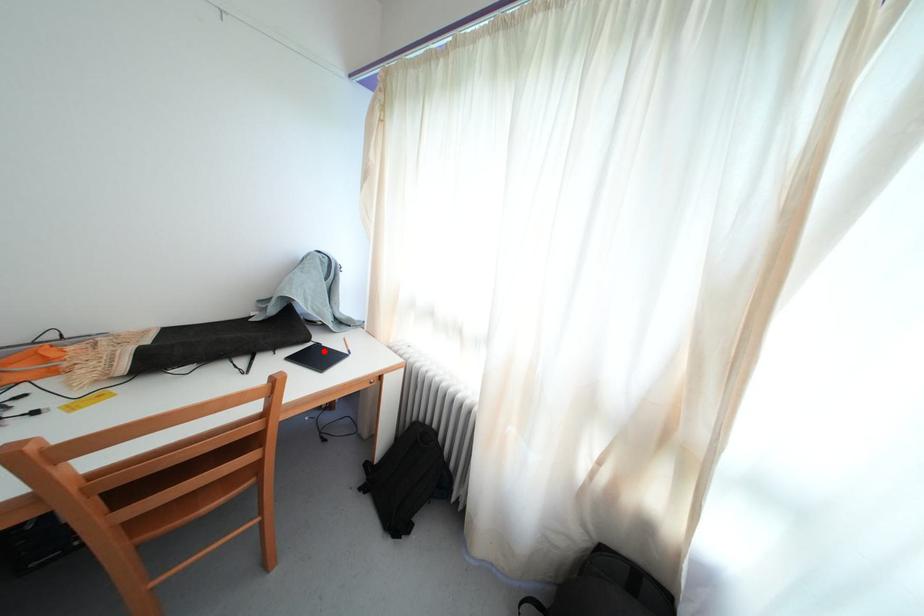
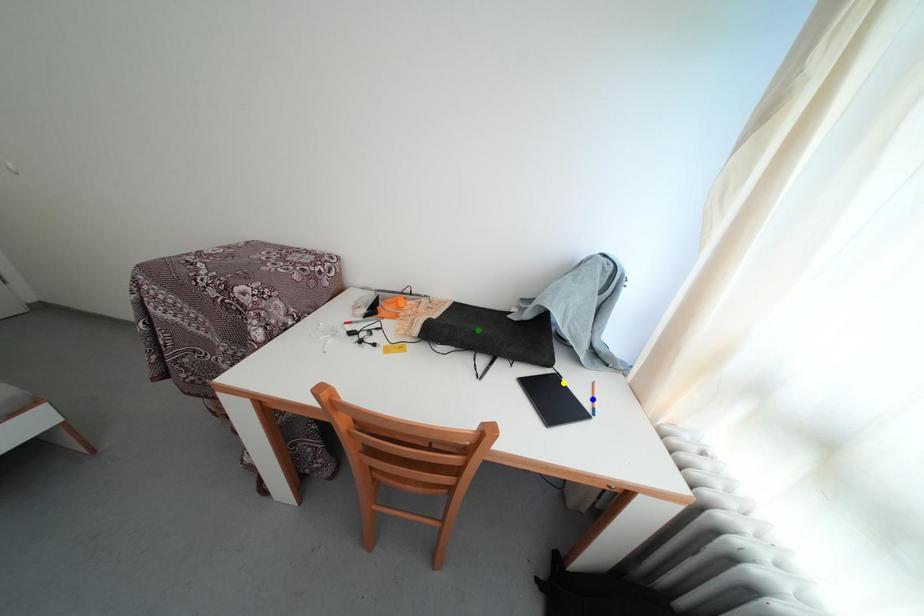
Question: I am providing you with two images of the same scene from different viewpoints. A red point is marked on the first image. You are given multiple points on the second image. Which point in image 2 is actually the same real-world point as the red point in image 1?

Choices:
 (A) yellow point
 (B) blue point
 (C) green point

Answer: (A)